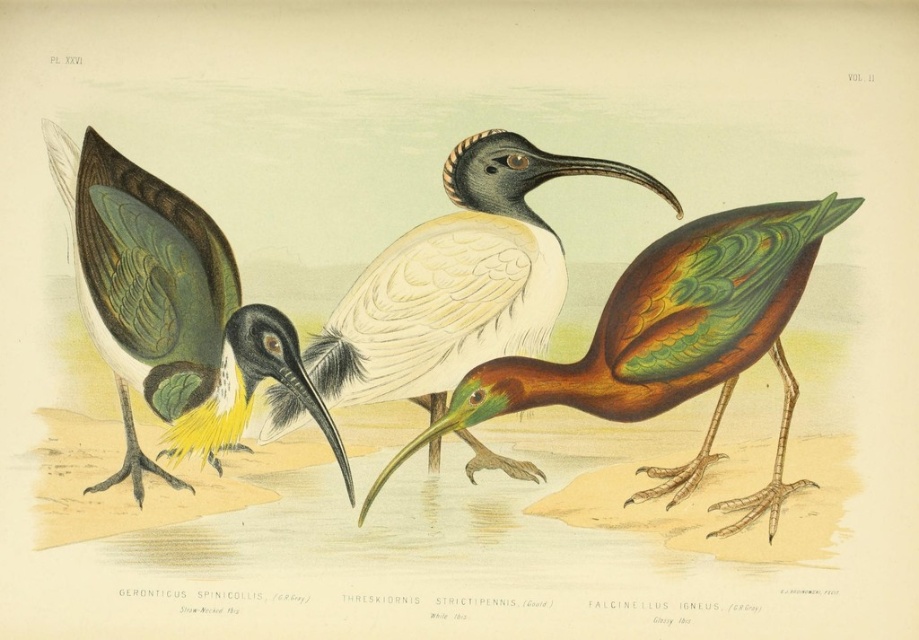
From the picture: You are an ornithologist observing the three ibis birds in the image. You notice the multicolored glossy ibis at center and the green glossy feathers at center. Which object is located higher in the image?

The green glossy feathers at center are higher in the image because the multicolored glossy ibis at center is positioned under them.

In the image, you see a multicolored glossy ibis at center and a white feathered bird at center. Which bird is positioned to the right of the other?

The multicolored glossy ibis at center is to the right of the white feathered bird at center.